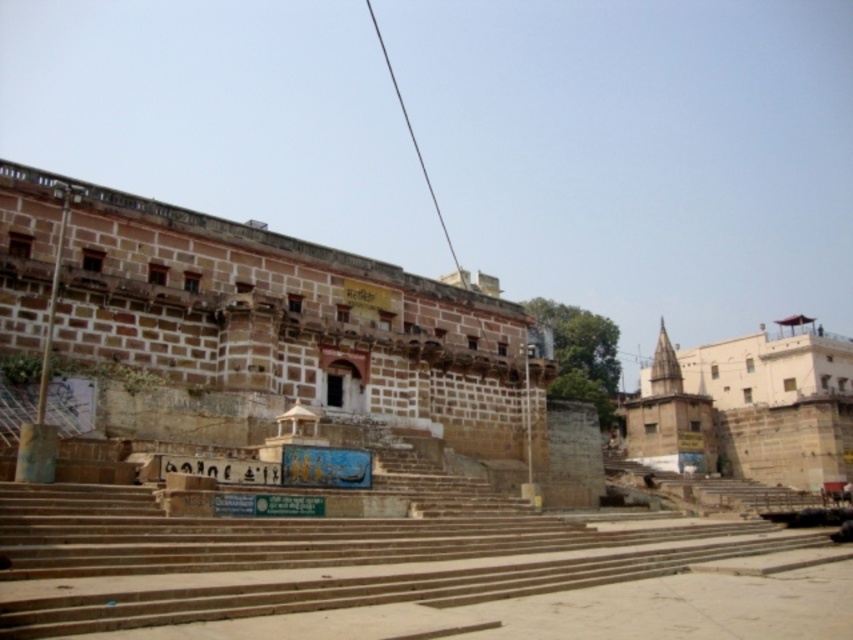
From the picture: You are a tourist visiting the ghat and want to take a photo of both the brown stone stairs at center and the beige stone temple at right. Based on their positions, which object should you place on the left side of your camera frame to include both in the shot?

You should place the brown stone stairs at center on the left side of your camera frame because they are positioned to the left of the beige stone temple at right, ensuring both are included in the shot.

You are standing at the top of the ghat steps and want to walk towards the water. There are two points marked on the steps you need to avoid because they are slippery. The points are labeled as point (267, 253) and point (747, 392). Which point should you avoid first as you descend the steps?

You should avoid point (267, 253) first because it is closer to the viewer than point (747, 392), meaning it is located higher up the steps and would be encountered earlier during your descent.